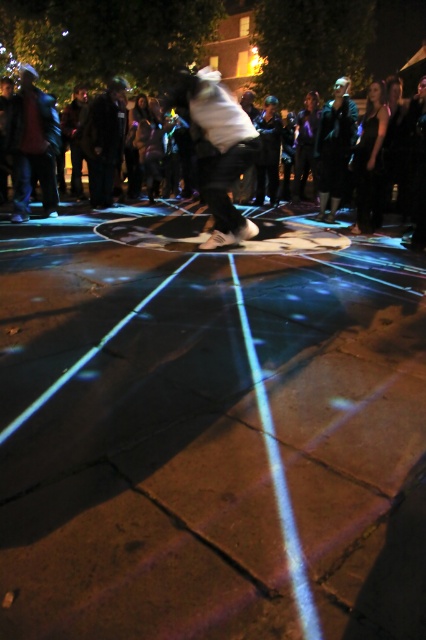
You are a photographer standing at the edge of the circular chalk drawing. You want to take a photo that includes both the black leather jacket at upper center and the dark brown leather jacket at upper left. Given that your camera has a maximum zoom range of 5 meters, will you be able to capture both jackets in the same frame without moving closer?

The black leather jacket at upper center is 4.88 meters from the dark brown leather jacket at upper left. Since the distance between them is within the camera maximum zoom range of 5 meters, you can capture both jackets in the same frame without moving closer.

You are a photographer trying to capture the entire scene of the performance. You notice the brown concrete pavement at center and the black leather jacket at upper center. Which object is wider in the image?

The brown concrete pavement at center is wider than the black leather jacket at upper center according to the description.

You are a photographer standing at the edge of the crowd. You want to capture the performer and the skateboard in the same frame. Given that the skateboard is at point (218, 148), which object should you focus on first to ensure both are in the shot?

You should focus on the white matte skateboard at center first because it is positioned at the center of the scene, ensuring both the performer and the skateboard are within the frame.